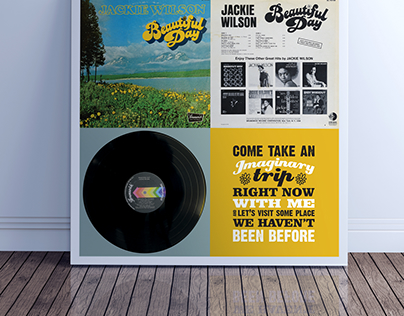
Identify the location of back wall. (29, 106), (374, 109).